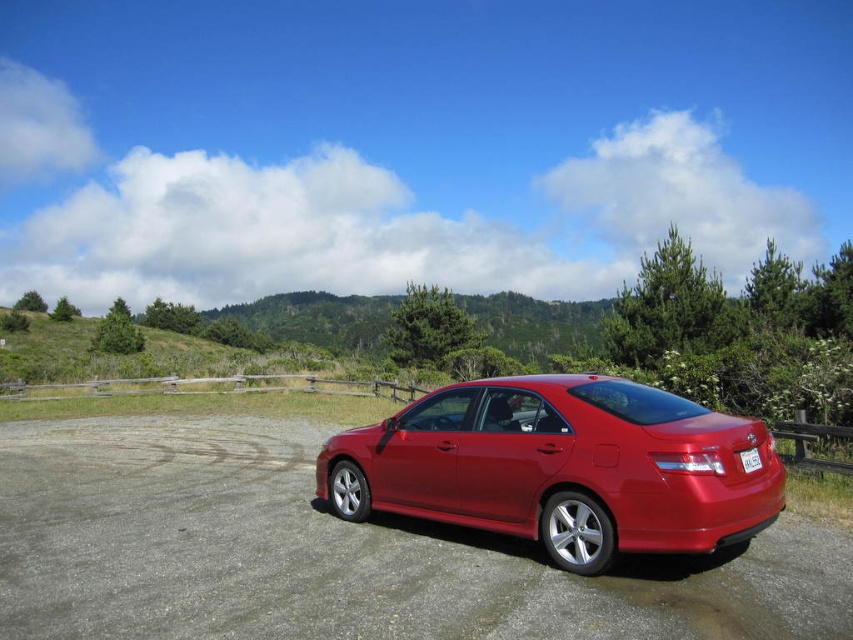
You are standing at the point marked by coordinates point (561,467). Looking around, you see the glossy metallic sedan at center. What object is located exactly at your current position?

The point (561,467) marks the glossy metallic sedan at center, so the object at your current position is the glossy metallic sedan at center.

You are a photographer trying to capture the glossy metallic sedan at center and the white plastic license plate at center in your shot. Which object should you focus on first if you want to ensure both are in sharp focus?

The glossy metallic sedan at center is in front of the white plastic license plate at center. To ensure both are in sharp focus, you should focus on the white plastic license plate at center since it is farther away, as depth of field will include the closer sedan naturally.